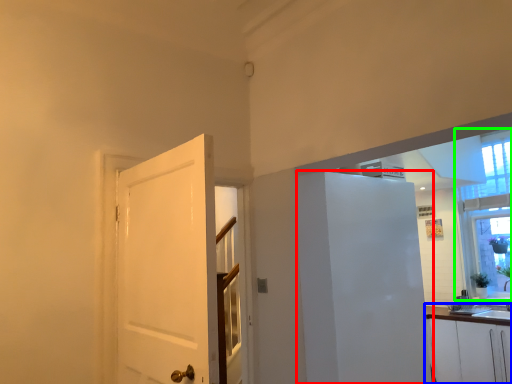
Question: Which object is the closest to the elevator (highlighted by a red box)? Choose among these: cabinetry (highlighted by a blue box) or window (highlighted by a green box).

Choices:
 (A) cabinetry
 (B) window

Answer: (A)